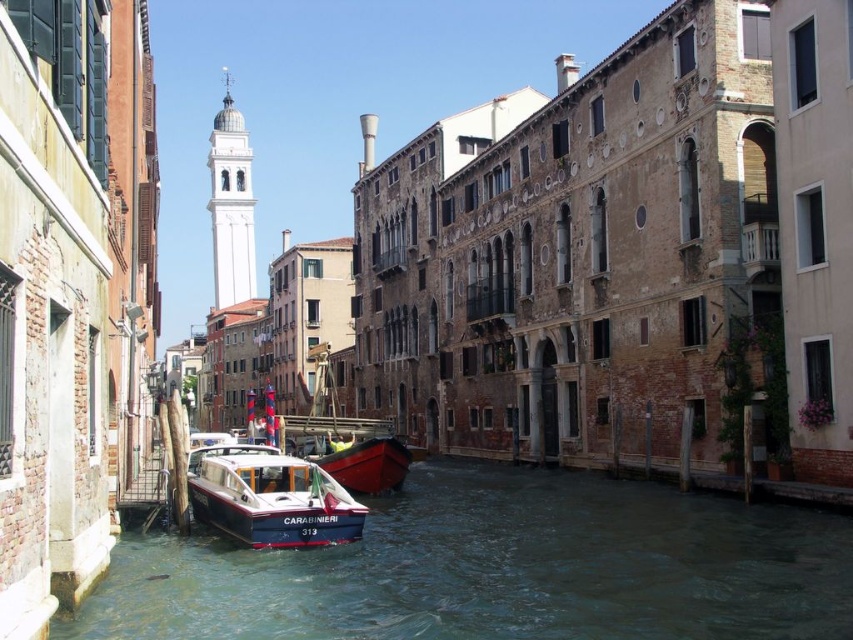
Question: Is clear water at lower left to the left of blue polished wood boat at center from the viewer's perspective?

Choices:
 (A) yes
 (B) no

Answer: (B)

Question: Which of these objects is positioned farthest from the red polished wood boat at center?

Choices:
 (A) clear water at lower left
 (B) blue polished wood boat at center

Answer: (A)

Question: Among these points, which one is nearest to the camera?

Choices:
 (A) (381, 448)
 (B) (735, 612)
 (C) (347, 508)

Answer: (B)

Question: In this image, where is clear water at lower left located relative to blue polished wood boat at center?

Choices:
 (A) below
 (B) above

Answer: (A)

Question: Among these points, which one is farthest from the camera?

Choices:
 (A) (289, 515)
 (B) (352, 445)

Answer: (B)

Question: Is clear water at lower left above blue polished wood boat at center?

Choices:
 (A) yes
 (B) no

Answer: (B)